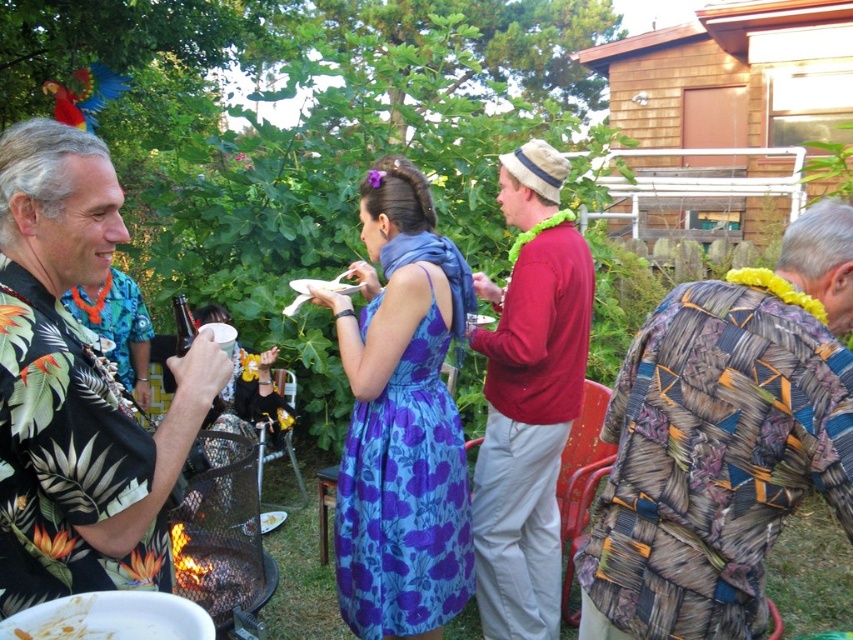
Which is below, patchwork fabric shirt at right or red cotton shirt at center?

red cotton shirt at center is lower down.

Locate an element on the screen. Image resolution: width=853 pixels, height=640 pixels. patchwork fabric shirt at right is located at coordinates (723, 440).

Find the location of a particular element. patchwork fabric shirt at right is located at coordinates (723, 440).

Is patchwork fabric shirt at right to the left of floral print shirt at left from the viewer's perspective?

Incorrect, patchwork fabric shirt at right is not on the left side of floral print shirt at left.

This screenshot has width=853, height=640. What do you see at coordinates (723, 440) in the screenshot? I see `patchwork fabric shirt at right` at bounding box center [723, 440].

I want to click on patchwork fabric shirt at right, so click(723, 440).

Consider the image. Is the position of floral print shirt at left more distant than that of matte purple dress at center?

That is False.

What do you see at coordinates (76, 387) in the screenshot? I see `floral print shirt at left` at bounding box center [76, 387].

What do you see at coordinates (76, 387) in the screenshot? I see `floral print shirt at left` at bounding box center [76, 387].

This screenshot has height=640, width=853. Identify the location of floral print shirt at left. (76, 387).